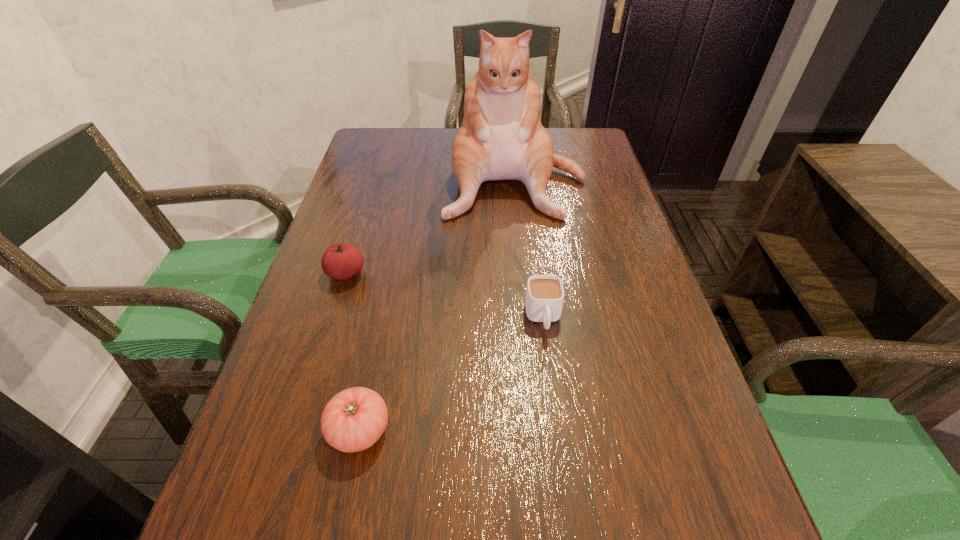
In order to click on cat in this screenshot , I will do point(501,137).

Find the location of a particular element. The image size is (960, 540). the tallest object is located at coordinates coord(501,137).

What are the coordinates of `the second farthest object` in the screenshot? It's located at (342, 261).

Identify the location of the farther tomato. The image size is (960, 540). (342, 261).

Locate an element on the screen. the right tomato is located at coordinates (354, 419).

The image size is (960, 540). Identify the location of the nearer tomato. (354, 419).

I want to click on cup, so click(544, 298).

You are a GUI agent. You are given a task and a screenshot of the screen. Output one action in this format:
    pyautogui.click(x=<x>, y=<y>)
    Task: Click on the vacant space situated on the face of the cat
    
    Given the screenshot: What is the action you would take?
    pyautogui.click(x=521, y=248)

Identify the location of free region located on the right of the left tomato. (428, 273).

The width and height of the screenshot is (960, 540). I want to click on vacant space situated on the back of the nearest object, so click(x=379, y=333).